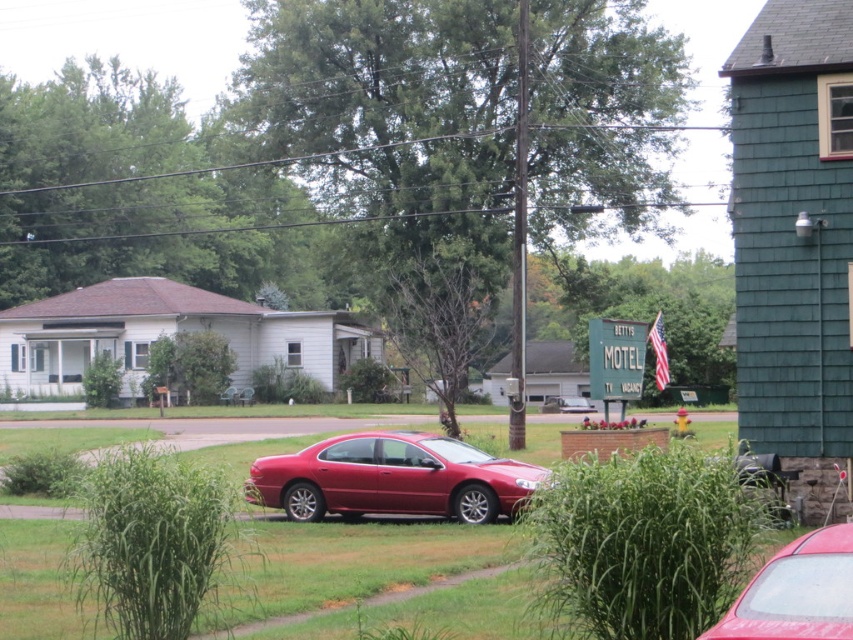
You are a guest arriving at Betty s Motel and see the green grass at center and the glossy red sedan at center. Which object is closer to the motel entrance?

The green grass at center is closer to the motel entrance because it is in front of the glossy red sedan at center, which is positioned further back.